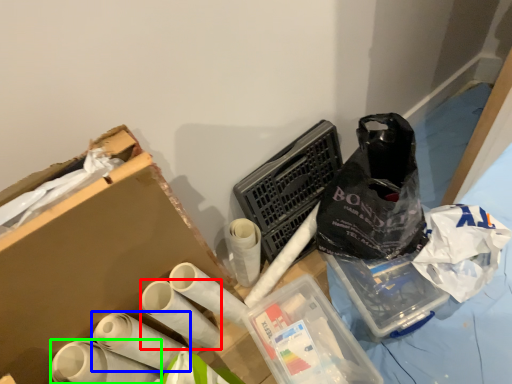
Question: Based on their relative distances, which object is farther from toilet paper (highlighted by a red box)? Choose from toilet paper (highlighted by a blue box) and toilet paper (highlighted by a green box).

Choices:
 (A) toilet paper
 (B) toilet paper

Answer: (B)